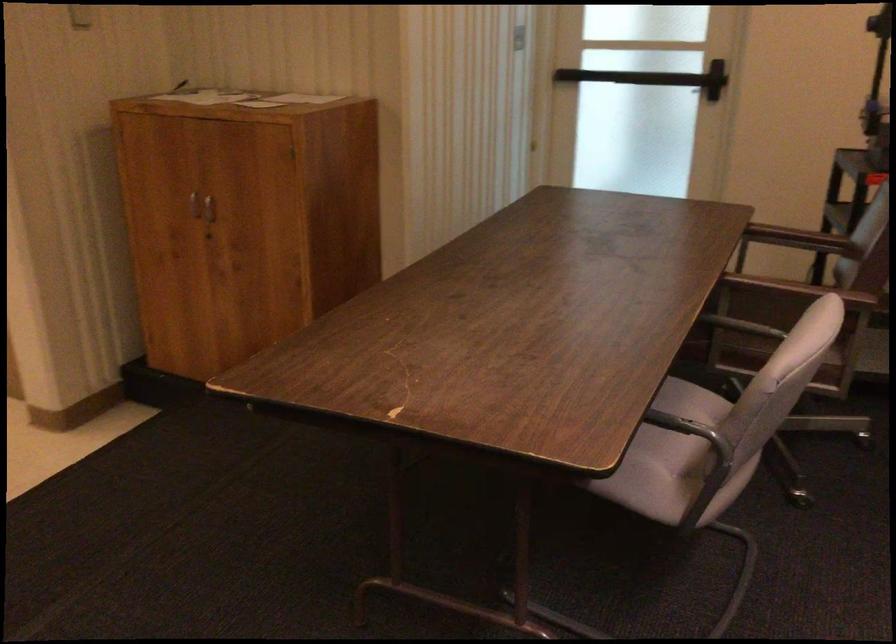
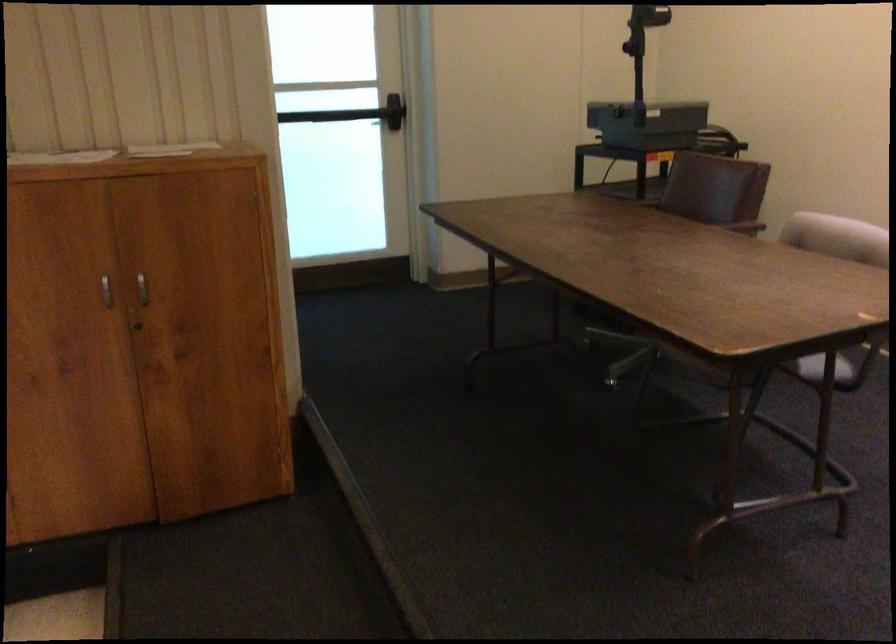
The point at (x=202, y=205) is marked in the first image. Where is the corresponding point in the second image?

(142, 289)